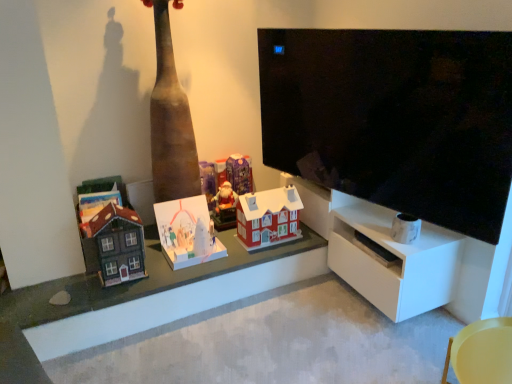
The height and width of the screenshot is (384, 512). Identify the location of free space above white matte shelf at right (from a real-world perspective). (388, 232).